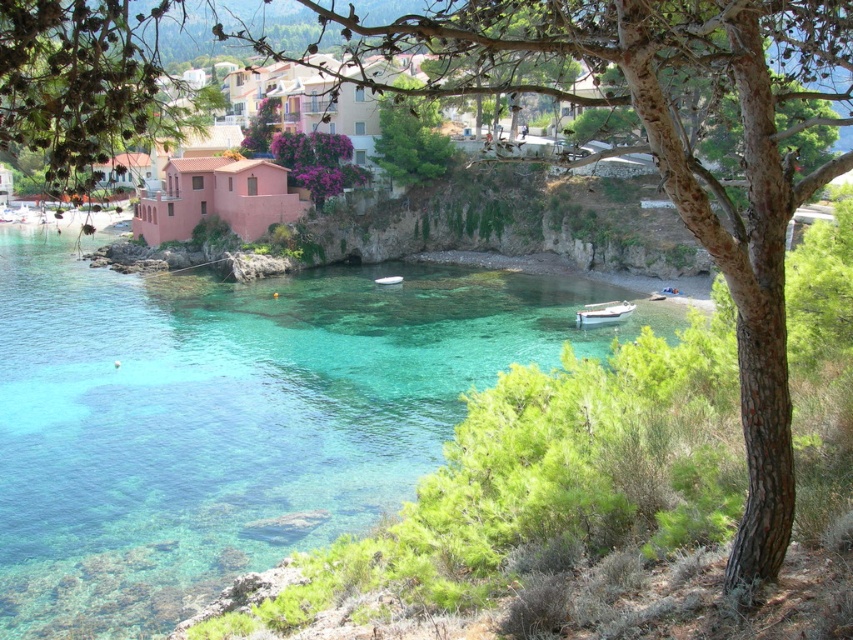
You are standing at the edge of the bay and want to take a photo that includes both the clear glass water at center and the white matte boat at lower center. Which object should you position closer to the bottom of your camera frame to ensure both are fully visible?

The white matte boat at lower center should be positioned closer to the bottom of the camera frame because the clear glass water at center has a greater height, allowing it to occupy more space upwards while the boat remains lower and closer to the frame edge.

You are standing at the point marked by the coordinates point (410, 140). Looking around, you see the green leafy tree at center. Which direction should you face to have the green leafy tree at center directly in front of you?

Since you are standing at the point where the green leafy tree at center is located, you are already at the same position as the tree. Therefore, you cannot face the tree directly because you are already there.

You are a photographer positioned at the edge of the shore, aiming to capture the clear glass water at center and the white matte boat at lower center in your shot. Which object should you adjust your camera to focus on first if you want to include both in the frame without moving your position?

The clear glass water at center is to the left of the white matte boat at lower center, so you should focus on the white matte boat at lower center first as it is closer to the shore where you are standing, allowing you to frame both objects effectively without moving.